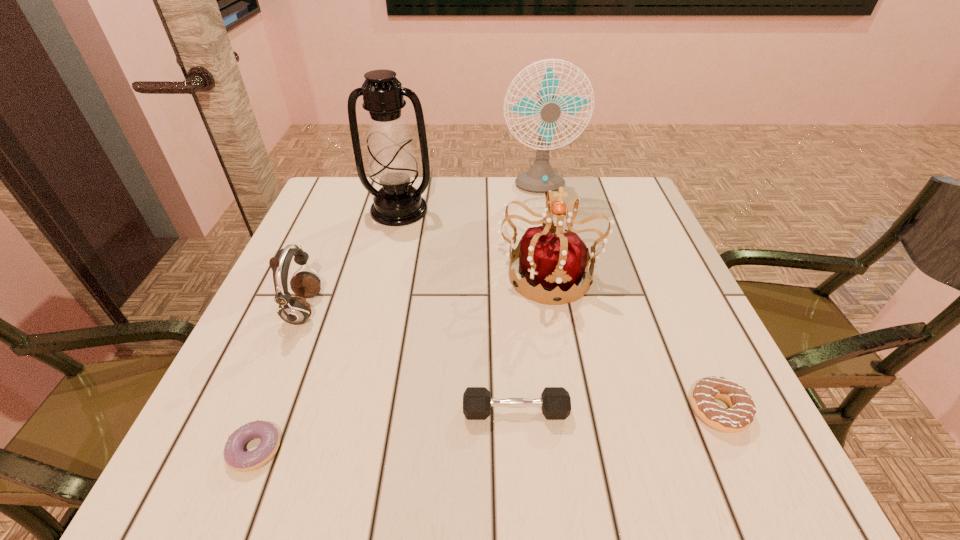
At what (x,y) coordinates should I click in order to perform the action: click on fan. Please return your answer as a coordinate pair (x, y). Looking at the image, I should click on (541, 177).

Where is `the third object from left to right`? the third object from left to right is located at coordinates (392, 163).

Where is `tiara`? tiara is located at coordinates (558, 261).

Locate an element on the screen. earphone is located at coordinates (294, 310).

Where is `dumbbell`? dumbbell is located at coordinates (555, 402).

You are a GUI agent. You are given a task and a screenshot of the screen. Output one action in this format:
    pyautogui.click(x=<x>, y=<y>)
    Task: Click on the right doughnut
    The width and height of the screenshot is (960, 540).
    Given the screenshot: What is the action you would take?
    pyautogui.click(x=740, y=416)

The image size is (960, 540). I want to click on the sixth tallest object, so click(740, 416).

This screenshot has width=960, height=540. I want to click on the shorter doughnut, so click(237, 459).

Find the location of `the shortest object`. the shortest object is located at coordinates [237, 459].

Where is `vacant space located on the front-facing side of the fan`? This screenshot has width=960, height=540. vacant space located on the front-facing side of the fan is located at coordinates (544, 221).